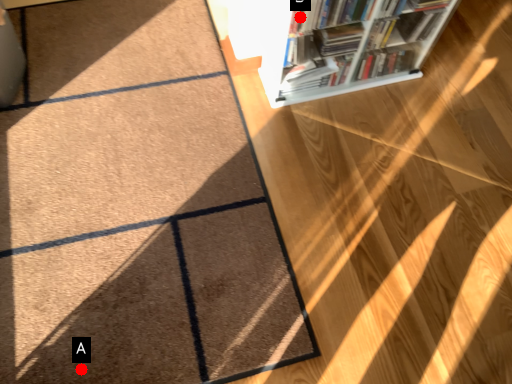
Question: Two points are circled on the image, labeled by A and B beside each circle. Which point is closer to the camera?

Choices:
 (A) A is closer
 (B) B is closer

Answer: (A)